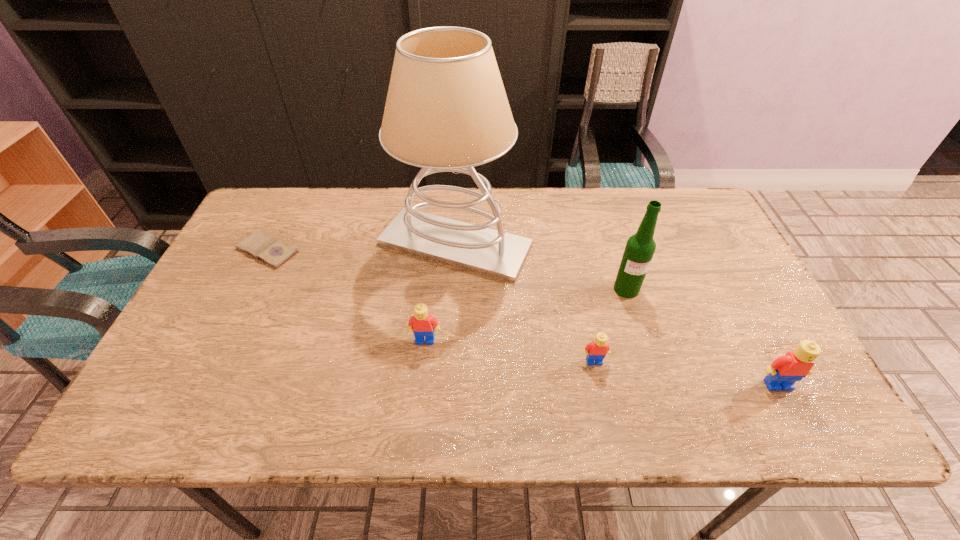
Where is `the second tallest Lego`? the second tallest Lego is located at coordinates (421, 324).

The image size is (960, 540). Find the location of `the farthest Lego`. the farthest Lego is located at coordinates (421, 324).

I want to click on the third object from right to left, so pos(596,350).

Identify the location of the fifth farthest object. (596, 350).

The height and width of the screenshot is (540, 960). What are the coordinates of `the fourth shortest object` in the screenshot? It's located at (784, 371).

Identify the location of the tallest Lego. The width and height of the screenshot is (960, 540). (784, 371).

The height and width of the screenshot is (540, 960). In order to click on beer bottle in this screenshot , I will do `click(640, 247)`.

Locate an element on the screen. the second tallest object is located at coordinates (640, 247).

Locate an element on the screen. table lamp is located at coordinates (446, 110).

The height and width of the screenshot is (540, 960). I want to click on the shortest object, so click(x=265, y=247).